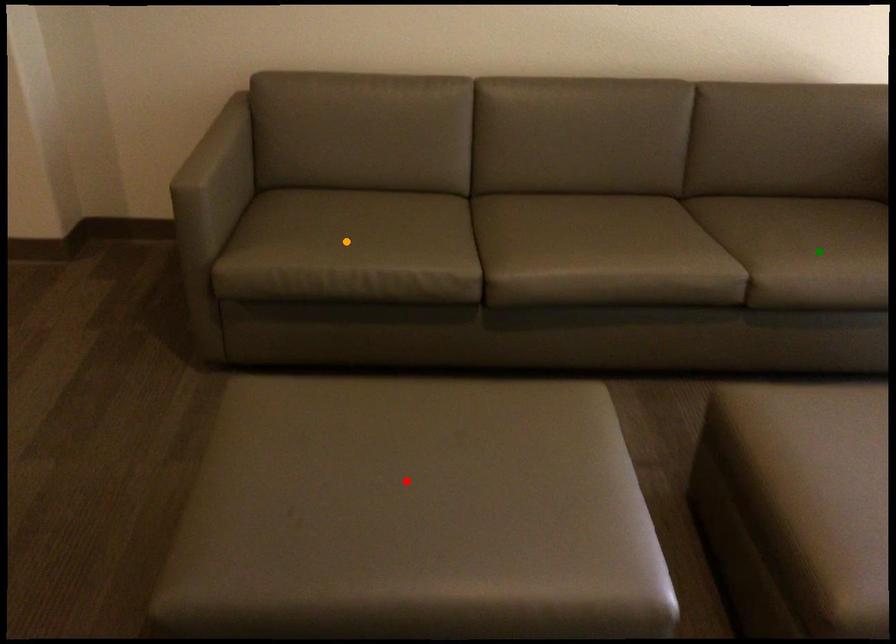
Order these from nearest to farthest:
orange point, red point, green point

red point
orange point
green point